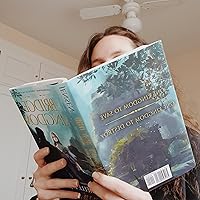
The width and height of the screenshot is (200, 200). What are the coordinates of `ceiling fan` in the screenshot? It's located at coord(135,18).